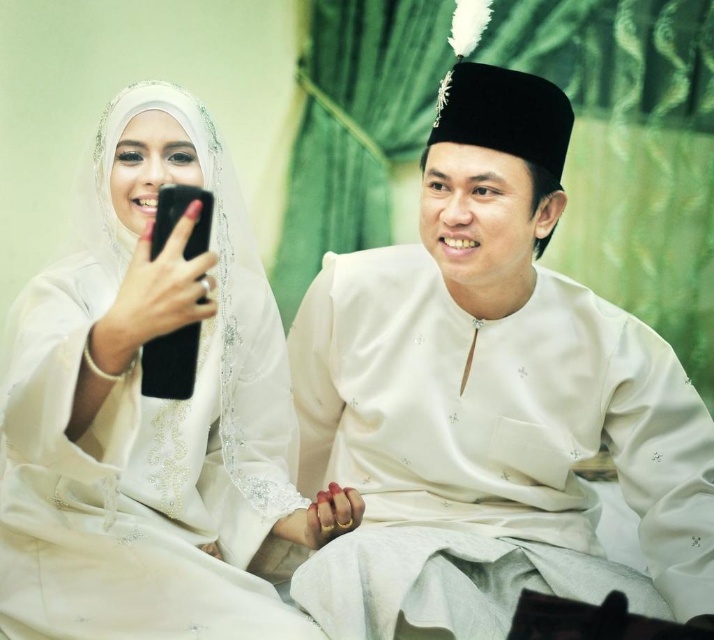
You are a photographer trying to capture a candid shot of the couple. You notice two points marked in the image. The first point is at coordinate point (438, 353) and the second is at point (174, 604). Which point is positioned further away from the camera lens?

Point (438, 353) is behind point (174, 604), so the first point is further away from the camera lens.

In the scene shown: You are a photographer setting up a camera at the center of the scene. The camera can capture objects within a 15 inch radius. Will both the white satin khat at center and the white sheer dress at left be in the camera frame?

The white satin khat at center is 16.13 inches away from the white sheer dress at left, which is beyond the camera frame of 15 inch radius. Therefore, the white sheer dress at left will be outside the camera frame while the white satin khat at center is within the frame.

You are a photographer standing 1.5 meters away from the camera. You want to adjust your position so that you can clearly see the white satin khat at center without moving the camera. Is it possible for you to move closer to the camera to achieve this?

The white satin khat at center is 1.41 meters away from the camera. Since you are currently 1.5 meters away from the camera, moving closer to the camera would bring you to a position between the camera and the khat. This would place you between the camera and the khat, potentially blocking the view. To see the khat clearly without moving the camera, you should move farther away from the camera, not closer.